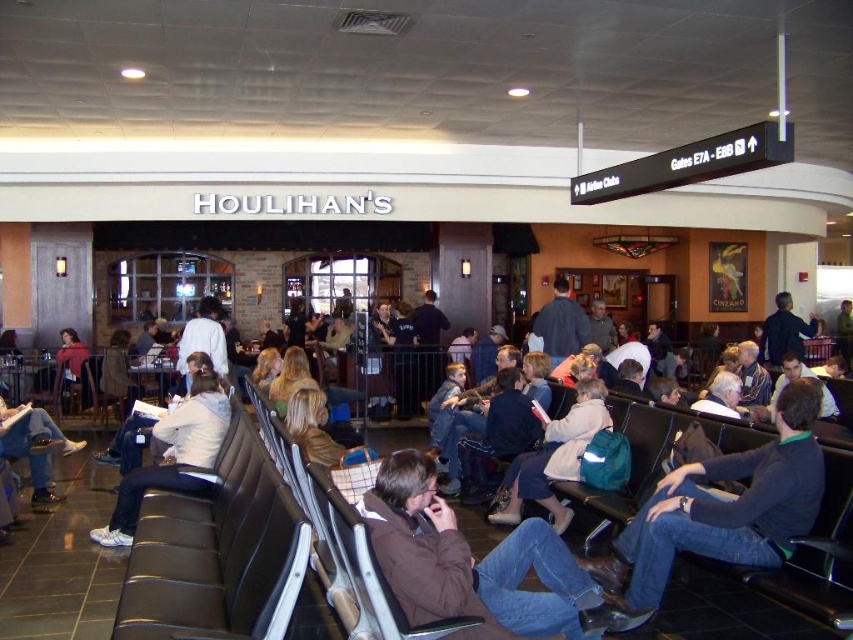
Between point (611, 616) and point (24, 451), which one is positioned in front?

Point (611, 616)

Locate an element on the screen. The height and width of the screenshot is (640, 853). dark brown leather jacket at center is located at coordinates (718, 512).

Can you confirm if black leather seat at center is positioned above dark blue shirt at center?

Actually, black leather seat at center is below dark blue shirt at center.

Find the location of a particular element. The image size is (853, 640). black leather seat at center is located at coordinates (218, 550).

Measure the distance between point (248, 488) and camera.

They are 3.64 meters apart.

Where is `black leather seat at center`? black leather seat at center is located at coordinates (218, 550).

The width and height of the screenshot is (853, 640). I want to click on black leather seat at center, so click(218, 550).

Can you confirm if black leather seat at center is positioned to the right of dark brown leather jacket at center?

Incorrect, black leather seat at center is not on the right side of dark brown leather jacket at center.

Who is more forward, (289, 513) or (634, 547)?

Point (289, 513)

Locate an element on the screen. black leather seat at center is located at coordinates (218, 550).